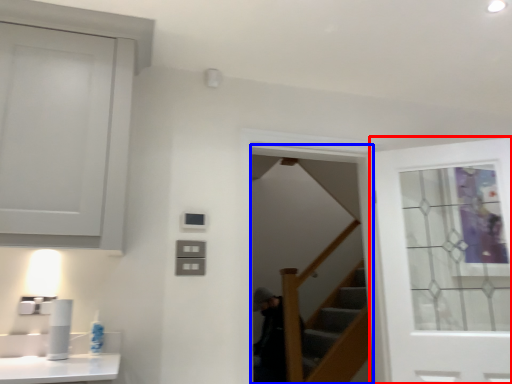
Question: Which object is closer to the camera taking this photo, door (highlighted by a red box) or screen door (highlighted by a blue box)?

Choices:
 (A) door
 (B) screen door

Answer: (A)